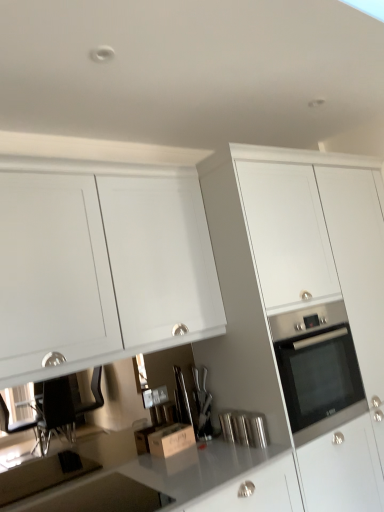
At what (x,y) coordinates should I click in order to perform the action: click on satin silver knife block at center, the second appliance from the right. Please return your answer as a coordinate pair (x, y). Looking at the image, I should click on click(x=183, y=400).

At what (x,y) coordinates should I click in order to perform the action: click on wooden cardboard box at center. Please return your answer as a coordinate pair (x, y). This screenshot has width=384, height=512. Looking at the image, I should click on (171, 440).

Describe the element at coordinates (101, 269) in the screenshot. The height and width of the screenshot is (512, 384). I see `white matte cabinet at upper left, the first cabinetry from the left` at that location.

What do you see at coordinates (302, 309) in the screenshot? I see `white glossy cabinet at center, which is counted as the second cabinetry, starting from the left` at bounding box center [302, 309].

Describe the element at coordinates (244, 428) in the screenshot. I see `polished stainless steel canister at center, the second appliance from the left` at that location.

I want to click on satin silver knife block at center, which is the 1th appliance in left-to-right order, so click(183, 400).

Is polished stainless steel canister at center, which appears as the 1th appliance when viewed from the right, looking in the opposite direction of satin silver knife block at center, the second appliance from the right?

Correct, polished stainless steel canister at center, which appears as the 1th appliance when viewed from the right, is looking away from satin silver knife block at center, the second appliance from the right.

From the image's perspective, which one is positioned higher, polished stainless steel canister at center, the second appliance from the left, or satin silver knife block at center, which is the 1th appliance in left-to-right order?

From the image's view, satin silver knife block at center, which is the 1th appliance in left-to-right order, is above.

Can you confirm if polished stainless steel canister at center, the second appliance from the left, is wider than satin silver knife block at center, marked as the second appliance in a front-to-back arrangement?

Yes.

Can you confirm if polished stainless steel canister at center, which appears as the 1th appliance when viewed from the right, is positioned to the right of satin silver knife block at center, which is the 1th appliance in left-to-right order?

Yes, polished stainless steel canister at center, which appears as the 1th appliance when viewed from the right, is to the right of satin silver knife block at center, which is the 1th appliance in left-to-right order.

Considering the points (176, 447) and (82, 182), which point is in front, point (176, 447) or point (82, 182)?

Point (82, 182)

Considering the sizes of wooden cardboard box at center and white matte cabinet at upper left, the first cabinetry from the left, in the image, is wooden cardboard box at center bigger or smaller than white matte cabinet at upper left, the first cabinetry from the left,?

Clearly, wooden cardboard box at center is smaller in size than white matte cabinet at upper left, the first cabinetry from the left.

Is wooden cardboard box at center not close to white matte cabinet at upper left, the first cabinetry from the left?

They are positioned close to each other.

Who is shorter, wooden cardboard box at center or white matte cabinet at upper left, acting as the second cabinetry starting from the right?

Answer: With less height is wooden cardboard box at center.

From their relative heights in the image, would you say polished stainless steel canister at center, which appears as the 1th appliance when viewed from the right, is taller or shorter than white glossy cabinet at center, the 1th cabinetry when ordered from right to left?

polished stainless steel canister at center, which appears as the 1th appliance when viewed from the right, is shorter than white glossy cabinet at center, the 1th cabinetry when ordered from right to left.

Choose the correct answer: Is polished stainless steel canister at center, the second appliance from the left, inside white glossy cabinet at center, the 1th cabinetry when ordered from right to left, or outside it?

polished stainless steel canister at center, the second appliance from the left, can be found inside white glossy cabinet at center, the 1th cabinetry when ordered from right to left.

From a real-world perspective, is polished stainless steel canister at center, the second appliance from the left, beneath white glossy cabinet at center, the 1th cabinetry when ordered from right to left?

Yes, from a real-world perspective, polished stainless steel canister at center, the second appliance from the left, is beneath white glossy cabinet at center, the 1th cabinetry when ordered from right to left.

Image resolution: width=384 pixels, height=512 pixels. In order to click on the 1st cabinetry in front of the polished stainless steel canister at center, positioned as the 2th appliance in back-to-front order, starting your count from the anchor in this screenshot , I will do `click(302, 309)`.

Relative to white matte cabinet at upper left, the first cabinetry from the left, is satin silver knife block at center, the second appliance from the right, in front or behind?

satin silver knife block at center, the second appliance from the right, is behind white matte cabinet at upper left, the first cabinetry from the left.

Is satin silver knife block at center, marked as the second appliance in a front-to-back arrangement, positioned far away from white matte cabinet at upper left, the first cabinetry from the left?

satin silver knife block at center, marked as the second appliance in a front-to-back arrangement, is actually quite close to white matte cabinet at upper left, the first cabinetry from the left.

Is satin silver knife block at center, the second appliance from the right, oriented towards white matte cabinet at upper left, the first cabinetry from the left?

No, satin silver knife block at center, the second appliance from the right, is not oriented towards white matte cabinet at upper left, the first cabinetry from the left.

From the image's perspective, would you say satin silver knife block at center, marked as the second appliance in a front-to-back arrangement, is shown under white matte cabinet at upper left, the first cabinetry from the left?

Yes.

Does polished stainless steel canister at center, which ranks as the 1th appliance in front-to-back order, touch wooden cardboard box at center?

No, polished stainless steel canister at center, which ranks as the 1th appliance in front-to-back order, is not in contact with wooden cardboard box at center.

Is polished stainless steel canister at center, which appears as the 1th appliance when viewed from the right, outside of wooden cardboard box at center?

Absolutely, polished stainless steel canister at center, which appears as the 1th appliance when viewed from the right, is external to wooden cardboard box at center.

Which is more distant, [258,435] or [194,439]?

The point [194,439] is farther.

Consider the image. Which object is wider, polished stainless steel canister at center, which ranks as the 1th appliance in front-to-back order, or wooden cardboard box at center?

wooden cardboard box at center is wider.

Does white glossy cabinet at center, the 1th cabinetry when ordered from right to left, have a greater height compared to wooden cardboard box at center?

Yes.

Looking at this image, from the image's perspective, relative to wooden cardboard box at center, is white glossy cabinet at center, the 1th cabinetry when ordered from right to left, above or below?

white glossy cabinet at center, the 1th cabinetry when ordered from right to left, is above wooden cardboard box at center.

Measure the distance from white glossy cabinet at center, which is counted as the second cabinetry, starting from the left, to wooden cardboard box at center.

white glossy cabinet at center, which is counted as the second cabinetry, starting from the left, and wooden cardboard box at center are 33.86 inches apart.

Considering the positions of objects white glossy cabinet at center, which is counted as the second cabinetry, starting from the left, and wooden cardboard box at center in the image provided, who is more to the left, white glossy cabinet at center, which is counted as the second cabinetry, starting from the left, or wooden cardboard box at center?

Positioned to the left is wooden cardboard box at center.

Does point (180, 431) appear closer or farther from the camera than point (185, 403)?

Point (180, 431) is closer to the camera than point (185, 403).

Can you confirm if wooden cardboard box at center is taller than satin silver knife block at center, which is counted as the 1th appliance, starting from the back?

No.

Between wooden cardboard box at center and satin silver knife block at center, marked as the second appliance in a front-to-back arrangement, which one appears on the left side from the viewer's perspective?

Positioned to the left is wooden cardboard box at center.

Find the location of a particular element. appliance that appears above the polished stainless steel canister at center, positioned as the 2th appliance in back-to-front order (from the image's perspective) is located at coordinates (183, 400).

The height and width of the screenshot is (512, 384). What are the coordinates of `cardboard box behind the white matte cabinet at upper left, acting as the second cabinetry starting from the right` in the screenshot? It's located at (171, 440).

Looking at the image, which one is located closer to white glossy cabinet at center, which is counted as the second cabinetry, starting from the left, white matte cabinet at upper left, acting as the second cabinetry starting from the right, or polished stainless steel canister at center, positioned as the 2th appliance in back-to-front order?

white matte cabinet at upper left, acting as the second cabinetry starting from the right, is positioned closer to the anchor white glossy cabinet at center, which is counted as the second cabinetry, starting from the left.

From the image, which object appears to be nearer to satin silver knife block at center, which is counted as the 1th appliance, starting from the back, wooden cardboard box at center or polished stainless steel canister at center, the second appliance from the left?

wooden cardboard box at center is closer to satin silver knife block at center, which is counted as the 1th appliance, starting from the back.

Looking at the image, which one is located further to white matte cabinet at upper left, acting as the second cabinetry starting from the right, wooden cardboard box at center or polished stainless steel canister at center, which ranks as the 1th appliance in front-to-back order?

polished stainless steel canister at center, which ranks as the 1th appliance in front-to-back order, is further to white matte cabinet at upper left, acting as the second cabinetry starting from the right.

From the picture: When comparing their distances from satin silver knife block at center, which is the 1th appliance in left-to-right order, does white matte cabinet at upper left, the first cabinetry from the left, or white glossy cabinet at center, which is counted as the second cabinetry, starting from the left, seem further?

Among the two, white matte cabinet at upper left, the first cabinetry from the left, is located further to satin silver knife block at center, which is the 1th appliance in left-to-right order.

Which object lies further to the anchor point wooden cardboard box at center, satin silver knife block at center, which is counted as the 1th appliance, starting from the back, or white matte cabinet at upper left, acting as the second cabinetry starting from the right?

white matte cabinet at upper left, acting as the second cabinetry starting from the right, is positioned further to the anchor wooden cardboard box at center.

Estimate the real-world distances between objects in this image. Which object is closer to white glossy cabinet at center, which is counted as the second cabinetry, starting from the left, satin silver knife block at center, the second appliance from the right, or white matte cabinet at upper left, acting as the second cabinetry starting from the right?

white matte cabinet at upper left, acting as the second cabinetry starting from the right, lies closer to white glossy cabinet at center, which is counted as the second cabinetry, starting from the left, than the other object.

Looking at the image, which one is located further to polished stainless steel canister at center, positioned as the 2th appliance in back-to-front order, satin silver knife block at center, the second appliance from the right, or white glossy cabinet at center, which is counted as the second cabinetry, starting from the left?

Among the two, white glossy cabinet at center, which is counted as the second cabinetry, starting from the left, is located further to polished stainless steel canister at center, positioned as the 2th appliance in back-to-front order.

Considering their positions, is satin silver knife block at center, the second appliance from the right, positioned further to wooden cardboard box at center than polished stainless steel canister at center, the second appliance from the left?

polished stainless steel canister at center, the second appliance from the left, is further to wooden cardboard box at center.

Find the location of a particular element. The image size is (384, 512). appliance located between satin silver knife block at center, marked as the second appliance in a front-to-back arrangement, and white glossy cabinet at center, the 1th cabinetry when ordered from right to left, in the left-right direction is located at coordinates (244, 428).

Where is `cardboard box situated between white matte cabinet at upper left, the first cabinetry from the left, and white glossy cabinet at center, which is counted as the second cabinetry, starting from the left, from left to right`? This screenshot has width=384, height=512. cardboard box situated between white matte cabinet at upper left, the first cabinetry from the left, and white glossy cabinet at center, which is counted as the second cabinetry, starting from the left, from left to right is located at coordinates (171, 440).

At what (x,y) coordinates should I click in order to perform the action: click on appliance between white matte cabinet at upper left, the first cabinetry from the left, and polished stainless steel canister at center, which appears as the 1th appliance when viewed from the right, vertically. Please return your answer as a coordinate pair (x, y). The image size is (384, 512). Looking at the image, I should click on (183, 400).

Where is `appliance between wooden cardboard box at center and polished stainless steel canister at center, positioned as the 2th appliance in back-to-front order`? appliance between wooden cardboard box at center and polished stainless steel canister at center, positioned as the 2th appliance in back-to-front order is located at coordinates (183, 400).